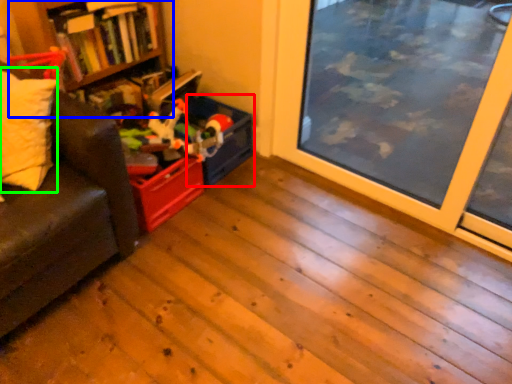
Question: Estimate the real-world distances between objects in this image. Which object is farther from storage box (highlighted by a red box), bookshelf (highlighted by a blue box) or pillow (highlighted by a green box)?

Choices:
 (A) bookshelf
 (B) pillow

Answer: (B)